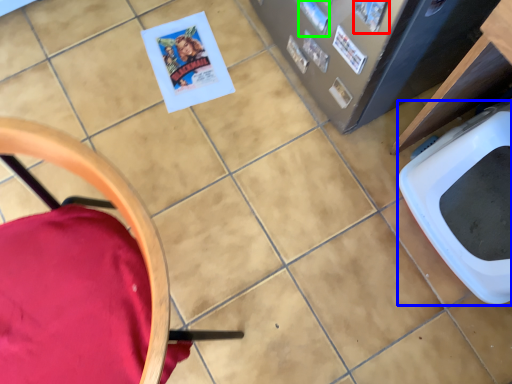
Question: Which object is the closest to the comic book (highlighted by a red box)? Choose among these: toilet bowl (highlighted by a blue box) or comic book (highlighted by a green box).

Choices:
 (A) toilet bowl
 (B) comic book

Answer: (B)